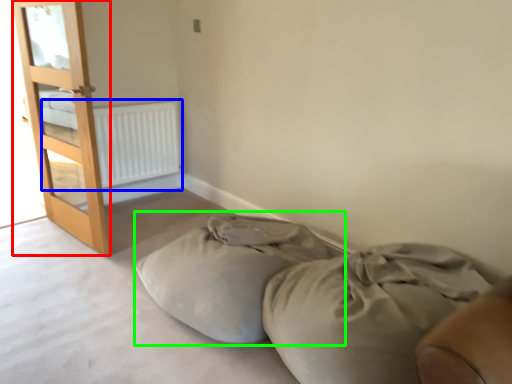
Question: Which is farther away from door (highlighted by a red box)? radiator (highlighted by a blue box) or bean bag chair (highlighted by a green box)?

Choices:
 (A) radiator
 (B) bean bag chair

Answer: (B)